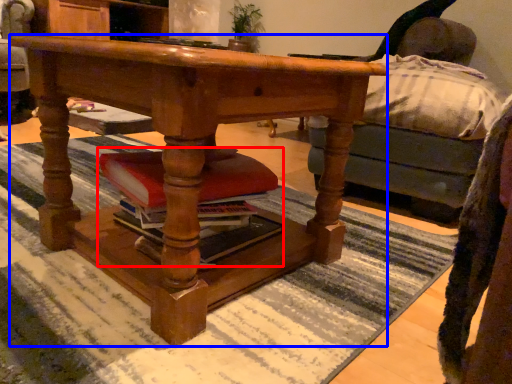
Question: Which point is further to the camera, book (highlighted by a red box) or desk (highlighted by a blue box)?

Choices:
 (A) book
 (B) desk

Answer: (A)